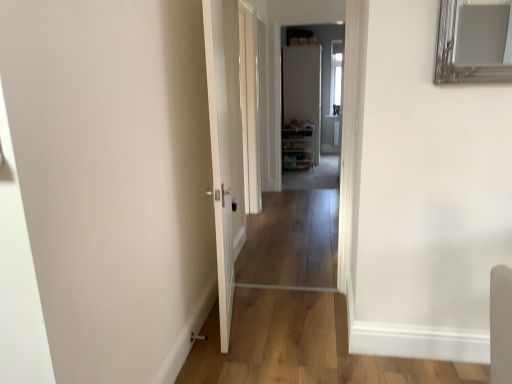
Question: Considering the relative sizes of white glossy door at upper center, the 1th door when ordered from back to front, and white glossy door at center, the first door viewed from the front, in the image provided, is white glossy door at upper center, the 1th door when ordered from back to front, wider than white glossy door at center, the first door viewed from the front,?

Choices:
 (A) no
 (B) yes

Answer: (A)

Question: Is white glossy door at upper center, which is the 2th door in front-to-back order, taller than white glossy door at center, acting as the first door starting from the left?

Choices:
 (A) no
 (B) yes

Answer: (B)

Question: Does white glossy door at upper center, the 1th door when ordered from back to front, lie in front of white glossy door at center, the first door viewed from the front?

Choices:
 (A) yes
 (B) no

Answer: (B)

Question: Could you tell me if white glossy door at upper center, the 1th door in the right-to-left sequence, is facing white glossy door at center, which appears as the second door when viewed from the right?

Choices:
 (A) yes
 (B) no

Answer: (A)

Question: Would you say white glossy door at upper center, marked as the 2th door in a left-to-right arrangement, contains white glossy door at center, the first door viewed from the front?

Choices:
 (A) no
 (B) yes

Answer: (A)

Question: From a real-world perspective, is clear glass door at center positioned above or below white glossy door at center, the first door viewed from the front?

Choices:
 (A) above
 (B) below

Answer: (A)

Question: Is point (245, 89) positioned closer to the camera than point (227, 145)?

Choices:
 (A) closer
 (B) farther

Answer: (B)

Question: In terms of width, does clear glass door at center look wider or thinner when compared to white glossy door at center, the second door from the back?

Choices:
 (A) wide
 (B) thin

Answer: (B)

Question: Considering their positions, is clear glass door at center located in front of or behind white glossy door at center, which appears as the second door when viewed from the right?

Choices:
 (A) behind
 (B) front

Answer: (A)

Question: From the image's perspective, relative to clear glass door at center, is white glossy door at center, acting as the first door starting from the left, above or below?

Choices:
 (A) above
 (B) below

Answer: (B)

Question: Does point (228, 172) appear closer or farther from the camera than point (247, 210)?

Choices:
 (A) farther
 (B) closer

Answer: (B)

Question: Considering the positions of white glossy door at center, acting as the first door starting from the left, and clear glass door at center in the image, is white glossy door at center, acting as the first door starting from the left, bigger or smaller than clear glass door at center?

Choices:
 (A) big
 (B) small

Answer: (A)

Question: From a real-world perspective, relative to clear glass door at center, is white glossy door at center, which appears as the second door when viewed from the right, vertically above or below?

Choices:
 (A) above
 (B) below

Answer: (B)

Question: Is clear glass door at center inside the boundaries of white glossy door at upper center, the 1th door in the right-to-left sequence, or outside?

Choices:
 (A) inside
 (B) outside

Answer: (B)

Question: Is clear glass door at center wider or thinner than white glossy door at upper center, the 1th door in the right-to-left sequence?

Choices:
 (A) wide
 (B) thin

Answer: (B)